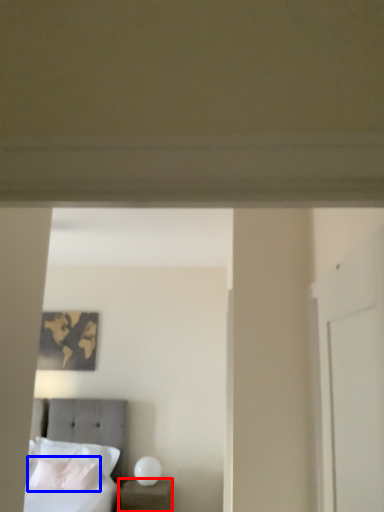
Question: Which of the following is the farthest to the observer, nightstand (highlighted by a red box) or pillow (highlighted by a blue box)?

Choices:
 (A) nightstand
 (B) pillow

Answer: (B)